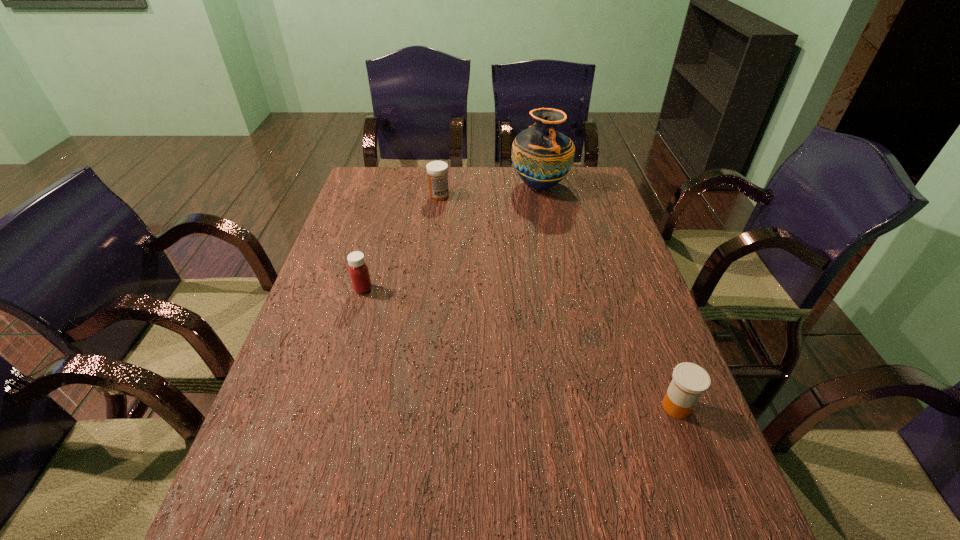
Locate which object is the second closest to the second medicine from right to left. Please provide its 2D coordinates. Your answer should be formatted as a tuple, i.e. [(x, y)], where the tuple contains the x and y coordinates of a point satisfying the conditions above.

[(358, 269)]

Point out which object is positioned as the second nearest to the tallest object. Please provide its 2D coordinates. Your answer should be formatted as a tuple, i.e. [(x, y)], where the tuple contains the x and y coordinates of a point satisfying the conditions above.

[(358, 269)]

This screenshot has height=540, width=960. Find the location of `medicine that is the closest one to the nearest medicine`. medicine that is the closest one to the nearest medicine is located at coordinates pyautogui.click(x=358, y=269).

Locate an element on the screen. The image size is (960, 540). the closest medicine to the rightmost medicine is located at coordinates (358, 269).